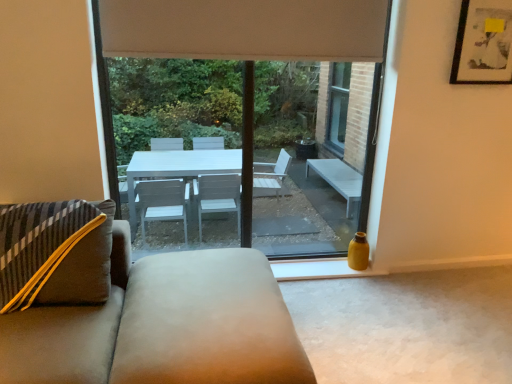
Question: Is matte black picture frame at upper right smaller than transparent glass window at center?

Choices:
 (A) yes
 (B) no

Answer: (A)

Question: Is the position of matte black picture frame at upper right more distant than that of transparent glass window at center?

Choices:
 (A) no
 (B) yes

Answer: (B)

Question: Considering the relative sizes of matte black picture frame at upper right and transparent glass window at center in the image provided, is matte black picture frame at upper right shorter than transparent glass window at center?

Choices:
 (A) yes
 (B) no

Answer: (A)

Question: From a real-world perspective, is matte black picture frame at upper right physically above transparent glass window at center?

Choices:
 (A) yes
 (B) no

Answer: (A)

Question: Considering the relative positions of matte black picture frame at upper right and transparent glass window at center in the image provided, is matte black picture frame at upper right in front of transparent glass window at center?

Choices:
 (A) yes
 (B) no

Answer: (B)

Question: Is suede ottoman at center situated inside matte black picture frame at upper right or outside?

Choices:
 (A) inside
 (B) outside

Answer: (B)

Question: Relative to matte black picture frame at upper right, is suede ottoman at center in front or behind?

Choices:
 (A) behind
 (B) front

Answer: (B)

Question: In terms of size, does suede ottoman at center appear bigger or smaller than matte black picture frame at upper right?

Choices:
 (A) big
 (B) small

Answer: (A)

Question: From the image's perspective, relative to matte black picture frame at upper right, is suede ottoman at center above or below?

Choices:
 (A) above
 (B) below

Answer: (B)

Question: Would you say suede ottoman at center is to the left or to the right of transparent glass window at center in the picture?

Choices:
 (A) right
 (B) left

Answer: (B)

Question: Which is correct: suede ottoman at center is inside transparent glass window at center, or outside of it?

Choices:
 (A) outside
 (B) inside

Answer: (A)

Question: From a real-world perspective, is suede ottoman at center positioned above or below transparent glass window at center?

Choices:
 (A) below
 (B) above

Answer: (A)

Question: In terms of size, does suede ottoman at center appear bigger or smaller than transparent glass window at center?

Choices:
 (A) big
 (B) small

Answer: (A)

Question: Would you say suede ottoman at center is inside or outside beige fabric curtain at upper center?

Choices:
 (A) outside
 (B) inside

Answer: (A)

Question: Is suede ottoman at center wider or thinner than beige fabric curtain at upper center?

Choices:
 (A) thin
 (B) wide

Answer: (B)